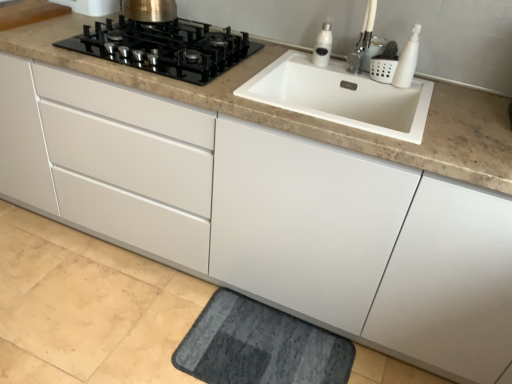
Question: From a real-world perspective, is white matte soap dispenser at upper right, the 2th soap dispenser when ordered from back to front, on top of white ceramic faucet at upper right?

Choices:
 (A) yes
 (B) no

Answer: (B)

Question: Is white matte soap dispenser at upper right, which is counted as the 2th soap dispenser, starting from the left, not within white ceramic faucet at upper right?

Choices:
 (A) yes
 (B) no

Answer: (A)

Question: Does white matte soap dispenser at upper right, which is counted as the 1th soap dispenser, starting from the right, contain white ceramic faucet at upper right?

Choices:
 (A) yes
 (B) no

Answer: (B)

Question: Can you see white matte soap dispenser at upper right, which is counted as the 1th soap dispenser, starting from the right, touching white ceramic faucet at upper right?

Choices:
 (A) yes
 (B) no

Answer: (B)

Question: Does white matte soap dispenser at upper right, the 2th soap dispenser when ordered from back to front, turn towards white ceramic faucet at upper right?

Choices:
 (A) yes
 (B) no

Answer: (B)

Question: Is white glossy soap dispenser at upper right, the 1th soap dispenser positioned from the left, taller or shorter than black glass gas stove at upper left?

Choices:
 (A) tall
 (B) short

Answer: (A)

Question: Considering the positions of white glossy soap dispenser at upper right, the 1th soap dispenser positioned from the left, and black glass gas stove at upper left in the image, is white glossy soap dispenser at upper right, the 1th soap dispenser positioned from the left, bigger or smaller than black glass gas stove at upper left?

Choices:
 (A) small
 (B) big

Answer: (A)

Question: Is point (330, 26) closer or farther from the camera than point (147, 46)?

Choices:
 (A) closer
 (B) farther

Answer: (B)

Question: Visually, is white glossy soap dispenser at upper right, the second soap dispenser from the right, positioned to the left or to the right of black glass gas stove at upper left?

Choices:
 (A) left
 (B) right

Answer: (B)

Question: Is point (369, 24) positioned closer to the camera than point (281, 342)?

Choices:
 (A) closer
 (B) farther

Answer: (A)

Question: Is white ceramic faucet at upper right to the left or to the right of dark gray textured bath mat at lower center in the image?

Choices:
 (A) right
 (B) left

Answer: (A)

Question: Relative to dark gray textured bath mat at lower center, is white ceramic faucet at upper right in front or behind?

Choices:
 (A) front
 (B) behind

Answer: (A)

Question: Is white ceramic faucet at upper right bigger or smaller than dark gray textured bath mat at lower center?

Choices:
 (A) small
 (B) big

Answer: (A)

Question: From their relative heights in the image, would you say white glossy soap dispenser at upper right, which appears as the 2th soap dispenser when viewed from the front, is taller or shorter than dark gray textured bath mat at lower center?

Choices:
 (A) short
 (B) tall

Answer: (B)

Question: Looking at the image, does white glossy soap dispenser at upper right, the 1th soap dispenser positioned from the left, seem bigger or smaller compared to dark gray textured bath mat at lower center?

Choices:
 (A) small
 (B) big

Answer: (A)